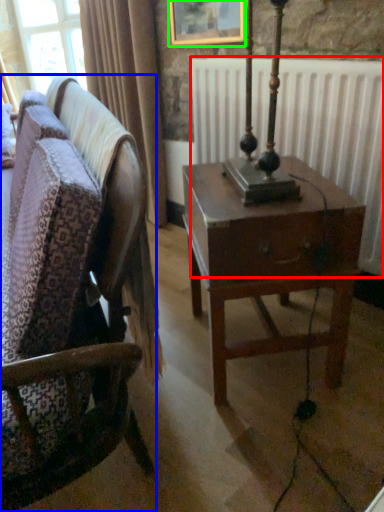
Question: Considering the real-world distances, which object is closest to radiator (highlighted by a red box)? chair (highlighted by a blue box) or picture frame (highlighted by a green box).

Choices:
 (A) chair
 (B) picture frame

Answer: (B)